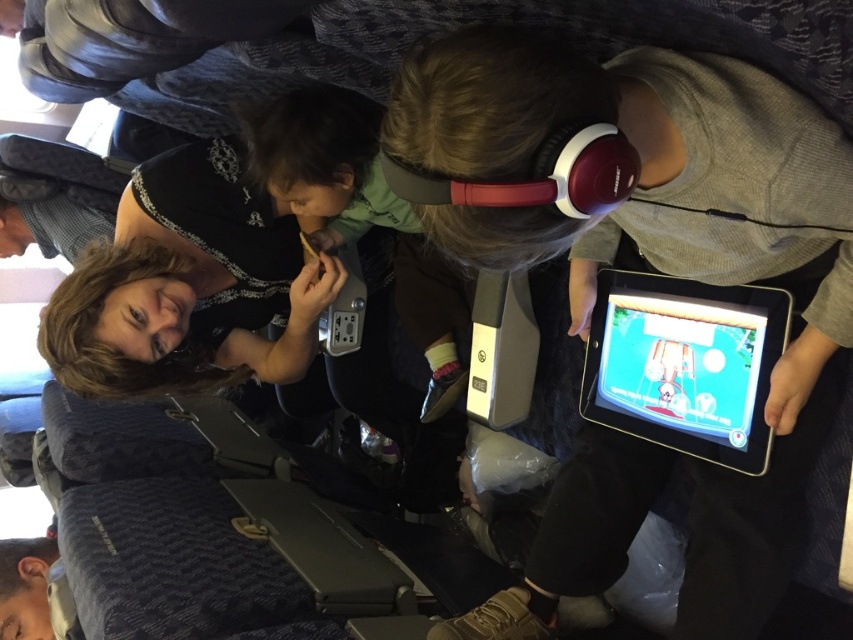
Question: Among these objects, which one is nearest to the camera?

Choices:
 (A) matte black dress at upper left
 (B) matte black tablet at center

Answer: (B)

Question: Which of the following is the farthest from the observer?

Choices:
 (A) matte black tablet at center
 (B) black glossy tablet at center
 (C) matte black dress at upper left

Answer: (C)

Question: Which of the following is the farthest from the observer?

Choices:
 (A) (521, 90)
 (B) (323, 262)

Answer: (B)

Question: Does matte black dress at upper left appear on the right side of black glossy tablet at center?

Choices:
 (A) yes
 (B) no

Answer: (B)

Question: Does matte black tablet at center appear over black glossy tablet at center?

Choices:
 (A) no
 (B) yes

Answer: (B)

Question: Considering the relative positions of matte black tablet at center and matte black dress at upper left in the image provided, where is matte black tablet at center located with respect to matte black dress at upper left?

Choices:
 (A) right
 (B) left

Answer: (A)